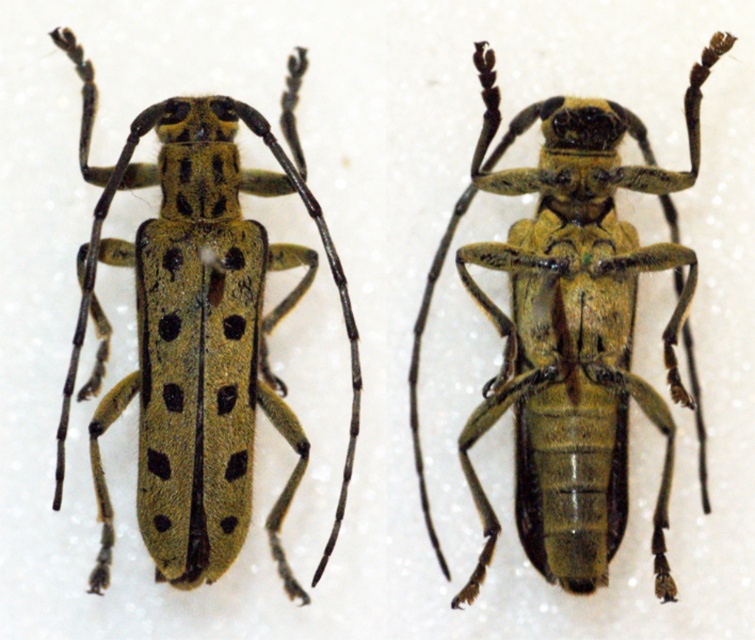
Who is higher up, green matte beetle at center or green textured beetle at center?

green textured beetle at center is above.

Does point (569, 481) lie in front of point (142, 244)?

No, it is behind (142, 244).

The width and height of the screenshot is (755, 640). In order to click on green matte beetle at center in this screenshot , I will do pos(572,332).